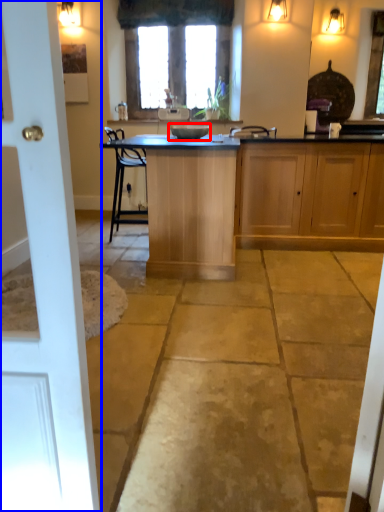
Question: Which object appears closest to the camera in this image, appliance (highlighted by a red box) or door (highlighted by a blue box)?

Choices:
 (A) appliance
 (B) door

Answer: (B)